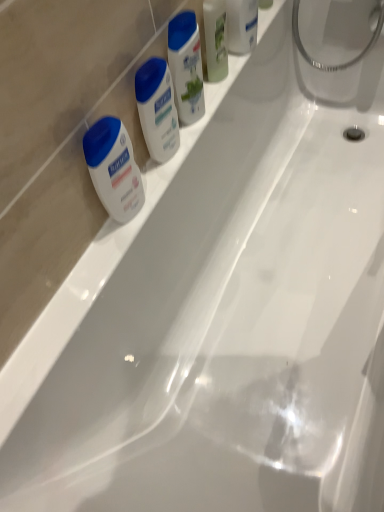
Image resolution: width=384 pixels, height=512 pixels. What do you see at coordinates (215, 39) in the screenshot? I see `green matte mouthwash at upper center` at bounding box center [215, 39].

Locate an element on the screen. This screenshot has width=384, height=512. translucent plastic soap at upper right, which appears as the fourth toiletry when ordered from the bottom is located at coordinates (265, 4).

Find the location of a particular element. This screenshot has height=512, width=384. white matte lotion at left is located at coordinates (114, 168).

Measure the distance between point [91,158] and camera.

27.09 inches.

Identify the location of white glossy lotion at upper center, which appears as the second toiletry when ordered from the bottom. (186, 66).

Locate an element on the screen. shaving cream below the white matte lotion at center, the 4th toiletry viewed from the top (from a real-world perspective) is located at coordinates (114, 168).

Is white matte lotion at left bigger or smaller than white matte lotion at center, the 4th toiletry viewed from the top?

Considering their sizes, white matte lotion at left takes up less space than white matte lotion at center, the 4th toiletry viewed from the top.

Between white matte lotion at left and white matte lotion at center, the 4th toiletry viewed from the top, which one appears on the left side from the viewer's perspective?

white matte lotion at left.

From the image's perspective, would you say white matte lotion at left is positioned over white matte lotion at center, the 1th toiletry positioned from the bottom?

No, from the image's perspective, white matte lotion at left is not over white matte lotion at center, the 1th toiletry positioned from the bottom.

Considering the relative positions of white matte lotion at left and white glossy lotion at upper center, positioned as the third toiletry in bottom-to-top order, in the image provided, is white matte lotion at left to the left of white glossy lotion at upper center, positioned as the third toiletry in bottom-to-top order, from the viewer's perspective?

Yes.

Does white matte lotion at left contain white glossy lotion at upper center, positioned as the third toiletry in bottom-to-top order?

No.

Who is taller, white matte lotion at left or white glossy lotion at upper center, acting as the 2th toiletry starting from the top?

white glossy lotion at upper center, acting as the 2th toiletry starting from the top.

In terms of height, does translucent plastic soap at upper right, which appears as the fourth toiletry when ordered from the bottom, look taller or shorter compared to white glossy lotion at upper center, positioned as the third toiletry in bottom-to-top order?

Considering their sizes, translucent plastic soap at upper right, which appears as the fourth toiletry when ordered from the bottom, has less height than white glossy lotion at upper center, positioned as the third toiletry in bottom-to-top order.

Can you confirm if translucent plastic soap at upper right, marked as the 1th toiletry in a top-to-bottom arrangement, is thinner than white glossy lotion at upper center, acting as the 2th toiletry starting from the top?

Indeed, translucent plastic soap at upper right, marked as the 1th toiletry in a top-to-bottom arrangement, has a lesser width compared to white glossy lotion at upper center, acting as the 2th toiletry starting from the top.

From the image's perspective, which object appears higher, translucent plastic soap at upper right, which appears as the fourth toiletry when ordered from the bottom, or white glossy lotion at upper center, positioned as the third toiletry in bottom-to-top order?

translucent plastic soap at upper right, which appears as the fourth toiletry when ordered from the bottom, appears higher in the image.

Is point (268, 7) closer or farther from the camera than point (234, 22)?

Clearly, point (268, 7) is more distant from the camera than point (234, 22).

From a real-world perspective, which object stands above the other?

green matte mouthwash at upper center is physically above.

Between white matte lotion at center, the 4th toiletry viewed from the top, and green matte mouthwash at upper center, which one appears on the left side from the viewer's perspective?

Positioned to the left is white matte lotion at center, the 4th toiletry viewed from the top.

Looking at this image, is white matte lotion at center, the 1th toiletry positioned from the bottom, oriented towards green matte mouthwash at upper center?

No, white matte lotion at center, the 1th toiletry positioned from the bottom, is not aimed at green matte mouthwash at upper center.

From the image's perspective, which is below, white matte lotion at center, the 1th toiletry positioned from the bottom, or green matte mouthwash at upper center?

From the image's view, white matte lotion at center, the 1th toiletry positioned from the bottom, is below.

Does white matte lotion at center, the 1th toiletry positioned from the bottom, contain white matte lotion at left?

That's incorrect, white matte lotion at left is not inside white matte lotion at center, the 1th toiletry positioned from the bottom.

Considering the sizes of objects white matte lotion at center, the 1th toiletry positioned from the bottom, and white matte lotion at left in the image provided, who is wider, white matte lotion at center, the 1th toiletry positioned from the bottom, or white matte lotion at left?

white matte lotion at center, the 1th toiletry positioned from the bottom.

Which of these two, white matte lotion at center, the 4th toiletry viewed from the top, or white matte lotion at left, stands taller?

With more height is white matte lotion at left.

Can you confirm if white glossy lotion at upper center, which appears as the second toiletry when ordered from the bottom, is wider than translucent plastic soap at upper right, marked as the 1th toiletry in a top-to-bottom arrangement?

Yes, white glossy lotion at upper center, which appears as the second toiletry when ordered from the bottom, is wider than translucent plastic soap at upper right, marked as the 1th toiletry in a top-to-bottom arrangement.

In the image, is white glossy lotion at upper center, which appears as the second toiletry when ordered from the bottom, positioned in front of or behind translucent plastic soap at upper right, which appears as the fourth toiletry when ordered from the bottom?

Visually, white glossy lotion at upper center, which appears as the second toiletry when ordered from the bottom, is located in front of translucent plastic soap at upper right, which appears as the fourth toiletry when ordered from the bottom.

Which is more distant, (175, 77) or (268, 2)?

The point (268, 2) is farther from the camera.

From a real-world perspective, is white glossy lotion at upper center, the third toiletry from the top, physically located above or below translucent plastic soap at upper right, which appears as the fourth toiletry when ordered from the bottom?

white glossy lotion at upper center, the third toiletry from the top, is above translucent plastic soap at upper right, which appears as the fourth toiletry when ordered from the bottom.

Could you tell me if white matte lotion at left is turned towards white glossy lotion at upper center, the third toiletry from the top?

No, white matte lotion at left is not facing towards white glossy lotion at upper center, the third toiletry from the top.

At what (x,y) coordinates should I click in order to perform the action: click on shaving cream lying below the white glossy lotion at upper center, the third toiletry from the top (from the image's perspective). Please return your answer as a coordinate pair (x, y). Looking at the image, I should click on (114, 168).

Which object is positioned more to the left, white matte lotion at left or white glossy lotion at upper center, which appears as the second toiletry when ordered from the bottom?

Positioned to the left is white matte lotion at left.

From a real-world perspective, is white matte lotion at left on top of white glossy lotion at upper center, the third toiletry from the top?

No.

Locate an element on the screen. shaving cream that appears below the white matte lotion at center, the 1th toiletry positioned from the bottom (from the image's perspective) is located at coordinates (114, 168).

Where is `shaving cream located in front of the white glossy lotion at upper center, positioned as the third toiletry in bottom-to-top order`? This screenshot has width=384, height=512. shaving cream located in front of the white glossy lotion at upper center, positioned as the third toiletry in bottom-to-top order is located at coordinates (114, 168).

Based on their spatial positions, is white glossy lotion at upper center, the third toiletry from the top, or green matte mouthwash at upper center further from white matte lotion at left?

green matte mouthwash at upper center is further to white matte lotion at left.

When comparing their distances from green matte mouthwash at upper center, does white matte lotion at center, the 4th toiletry viewed from the top, or translucent plastic soap at upper right, which appears as the fourth toiletry when ordered from the bottom, seem closer?

translucent plastic soap at upper right, which appears as the fourth toiletry when ordered from the bottom, is closer to green matte mouthwash at upper center.

Considering their positions, is white glossy lotion at upper center, the third toiletry from the top, positioned further to green matte mouthwash at upper center than white matte lotion at center, the 4th toiletry viewed from the top?

Among the two, white matte lotion at center, the 4th toiletry viewed from the top, is located further to green matte mouthwash at upper center.

Considering their positions, is white matte lotion at center, the 4th toiletry viewed from the top, positioned further to white matte lotion at left than white glossy lotion at upper center, positioned as the third toiletry in bottom-to-top order?

The object further to white matte lotion at left is white glossy lotion at upper center, positioned as the third toiletry in bottom-to-top order.

In the scene shown: When comparing their distances from white matte lotion at center, the 4th toiletry viewed from the top, does translucent plastic soap at upper right, which appears as the fourth toiletry when ordered from the bottom, or green matte mouthwash at upper center seem closer?

green matte mouthwash at upper center.

In the scene shown: Which object lies nearer to the anchor point white matte lotion at center, the 1th toiletry positioned from the bottom, white glossy lotion at upper center, which appears as the second toiletry when ordered from the bottom, or green matte mouthwash at upper center?

white glossy lotion at upper center, which appears as the second toiletry when ordered from the bottom, is positioned closer to the anchor white matte lotion at center, the 1th toiletry positioned from the bottom.

When comparing their distances from white glossy lotion at upper center, positioned as the third toiletry in bottom-to-top order, does white matte lotion at left or translucent plastic soap at upper right, which appears as the fourth toiletry when ordered from the bottom, seem further?

white matte lotion at left is positioned further to the anchor white glossy lotion at upper center, positioned as the third toiletry in bottom-to-top order.

Considering their positions, is translucent plastic soap at upper right, which appears as the fourth toiletry when ordered from the bottom, positioned closer to white glossy lotion at upper center, positioned as the third toiletry in bottom-to-top order, than green matte mouthwash at upper center?

Among the two, green matte mouthwash at upper center is located nearer to white glossy lotion at upper center, positioned as the third toiletry in bottom-to-top order.

Identify the location of toiletry between white glossy lotion at upper center, which appears as the second toiletry when ordered from the bottom, and white matte lotion at left in the up-down direction. (157, 109).

Where is `mouthwash that lies between translucent plastic soap at upper right, which appears as the fourth toiletry when ordered from the bottom, and white matte lotion at left from top to bottom`? mouthwash that lies between translucent plastic soap at upper right, which appears as the fourth toiletry when ordered from the bottom, and white matte lotion at left from top to bottom is located at coordinates (215, 39).

Locate an element on the screen. mouthwash that lies between translucent plastic soap at upper right, which appears as the fourth toiletry when ordered from the bottom, and white glossy lotion at upper center, the third toiletry from the top, from top to bottom is located at coordinates (215, 39).

Locate an element on the screen. This screenshot has height=512, width=384. mouthwash that lies between white glossy lotion at upper center, acting as the 2th toiletry starting from the top, and white matte lotion at left from top to bottom is located at coordinates [215, 39].